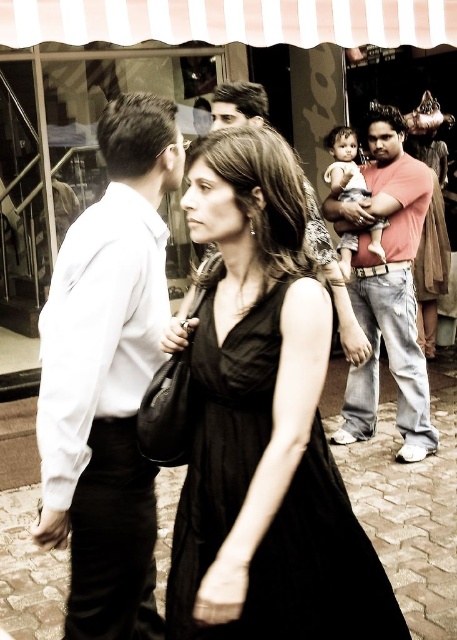
In the scene shown: You are a photographer trying to capture a candid shot of the two people in the scene. You notice two specific points of interest marked as point 1 at coordinates point (343,406) and point 2 at coordinates point (350,132). Which point should you focus on to ensure the subject is in sharp focus if you want the person closer to the camera to be clear?

Point 1 at coordinates point (343,406) should be focused on because it is closer to the camera than point 2 at coordinates point (350,132).

You are a fashion designer observing the street scene. You need to determine which clothing item is shorter in length between the black fabric dress at center and the white shirt at left. Based on the scene, which one is shorter?

The black fabric dress at center is shorter than the white shirt at left, so the black fabric dress at center is the shorter clothing item.